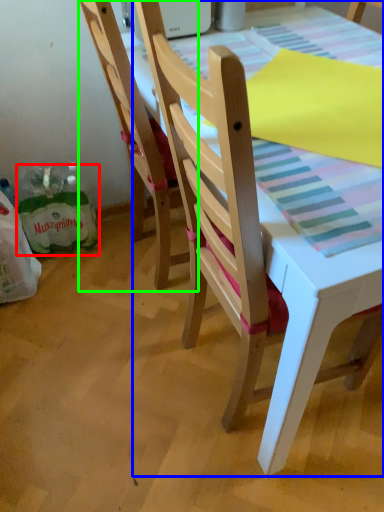
Question: Estimate the real-world distances between objects in this image. Which object is closer to shopping bag (highlighted by a red box), chair (highlighted by a blue box) or chair (highlighted by a green box)?

Choices:
 (A) chair
 (B) chair

Answer: (B)